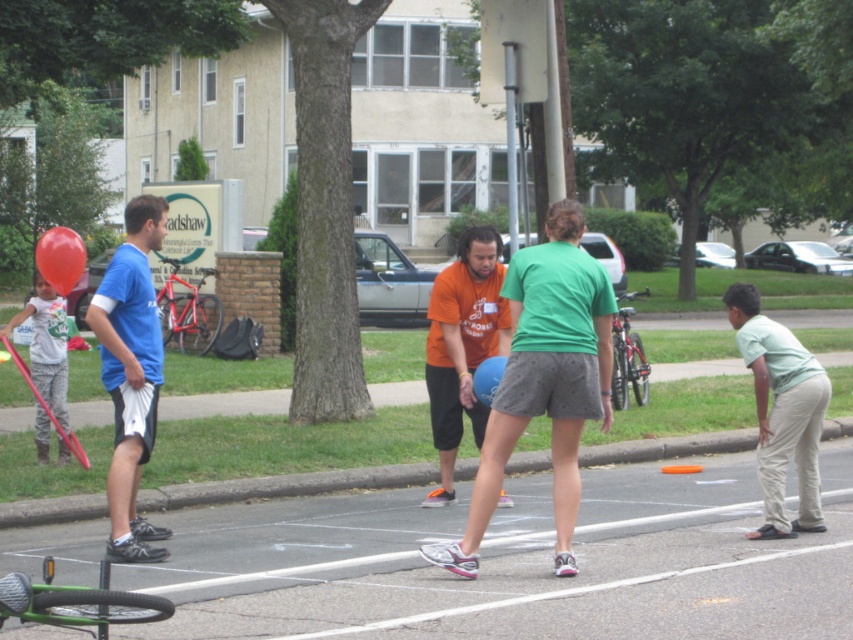
What is the color of the pants at the location of point (47, 353)?

The point (47, 353) is on matte gray pants at left.